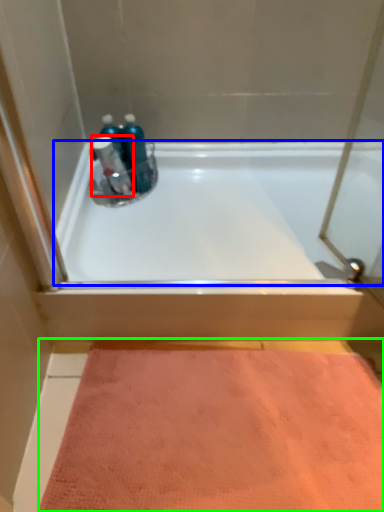
Question: Which object is positioned closest to cleaning product (highlighted by a red box)? Select from bathtub (highlighted by a blue box) and doormat (highlighted by a green box).

Choices:
 (A) bathtub
 (B) doormat

Answer: (A)